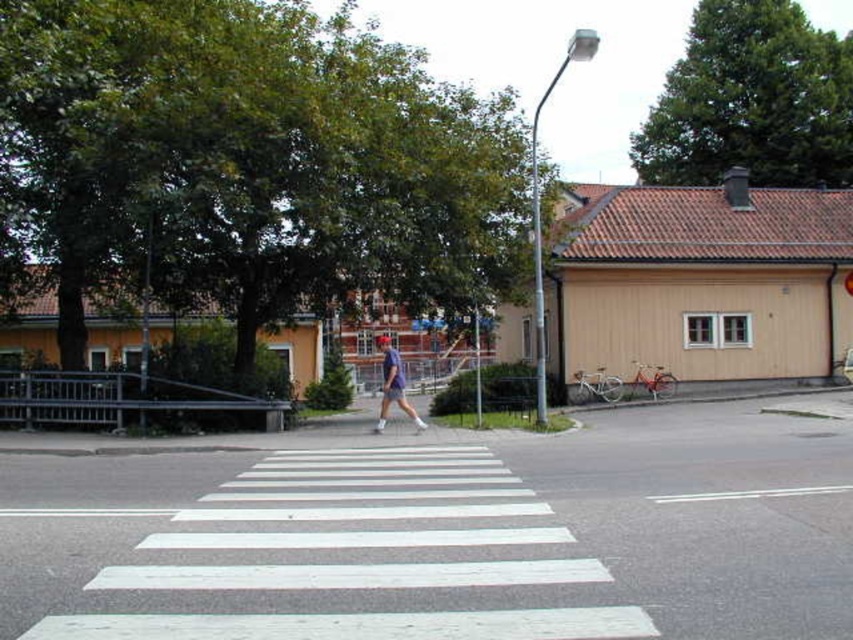
In the scene shown: You are a pedestrian standing at the edge of the white painted crosswalk at center. You need to reach the blue fabric shorts at center which is on the other side. Is the crosswalk wide enough for you to walk straight to the shorts without stepping off the crosswalk?

The white painted crosswalk at center is closer to the viewer than blue fabric shorts at center, so the crosswalk is not wide enough to reach the blue fabric shorts at center without stepping off.

You are a self driving car that is 2 meters wide. You are approaching the white painted crosswalk at center. The crosswalk is located at point 0.866, 0.354 in the image. Can you safely pass through the crosswalk without crossing into the adjacent lanes?

The white painted crosswalk at center is located at point (300, 554) in the image. Since the crosswalk is a designated pedestrian area, the self driving car should stop and yield to pedestrians. Therefore, it cannot safely pass through the crosswalk while the pedestrian is present.

You are standing at the pedestrian crossing and want to take a photo of the two points mentioned. Which point, point (328, 493) or point (380, 336), will appear larger in your camera view?

Point (328, 493) is closer to the camera than point 0.525, 0447, so it will appear larger in the camera view.